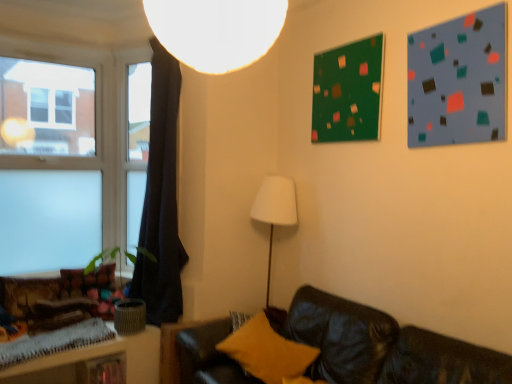
Question: Should I look upward or downward to see white matte lampshade at upper center?

Choices:
 (A) down
 (B) up

Answer: (B)

Question: Is green matte bulletin board at upper center, the 2th bulletin board when ordered from right to left, bigger than white matte lampshade at upper center?

Choices:
 (A) yes
 (B) no

Answer: (B)

Question: Does green matte bulletin board at upper center, which appears as the 1th bulletin board when viewed from the back, have a lesser height compared to white matte lampshade at upper center?

Choices:
 (A) yes
 (B) no

Answer: (B)

Question: Does green matte bulletin board at upper center, the 2th bulletin board when ordered from right to left, turn towards white matte lampshade at upper center?

Choices:
 (A) no
 (B) yes

Answer: (A)

Question: Could white matte lampshade at upper center be considered to be inside green matte bulletin board at upper center, which is the second bulletin board from front to back?

Choices:
 (A) yes
 (B) no

Answer: (B)

Question: Is green matte bulletin board at upper center, acting as the 1th bulletin board starting from the left, further to camera compared to white matte lampshade at upper center?

Choices:
 (A) no
 (B) yes

Answer: (B)

Question: Can you confirm if green matte bulletin board at upper center, the 2th bulletin board when ordered from right to left, is positioned to the left of white matte lampshade at upper center?

Choices:
 (A) yes
 (B) no

Answer: (B)

Question: Does green matte bulletin board at upper center, which is the second bulletin board from front to back, have a greater width compared to wooden textured table at lower left?

Choices:
 (A) no
 (B) yes

Answer: (A)

Question: From a real-world perspective, is green matte bulletin board at upper center, acting as the 1th bulletin board starting from the left, positioned under wooden textured table at lower left based on gravity?

Choices:
 (A) no
 (B) yes

Answer: (A)

Question: From a real-world perspective, is green matte bulletin board at upper center, the 2th bulletin board when ordered from right to left, on wooden textured table at lower left?

Choices:
 (A) yes
 (B) no

Answer: (A)

Question: Considering the relative sizes of green matte bulletin board at upper center, which is the second bulletin board from front to back, and wooden textured table at lower left in the image provided, is green matte bulletin board at upper center, which is the second bulletin board from front to back, bigger than wooden textured table at lower left?

Choices:
 (A) yes
 (B) no

Answer: (B)

Question: Is green matte bulletin board at upper center, acting as the 1th bulletin board starting from the left, thinner than wooden textured table at lower left?

Choices:
 (A) no
 (B) yes

Answer: (B)

Question: Is green matte bulletin board at upper center, which appears as the 1th bulletin board when viewed from the back, oriented away from wooden textured table at lower left?

Choices:
 (A) no
 (B) yes

Answer: (A)

Question: From a real-world perspective, is dark fabric curtain at left beneath yellow fuzzy pillow at lower center, marked as the 1th pillow in a right-to-left arrangement?

Choices:
 (A) yes
 (B) no

Answer: (B)